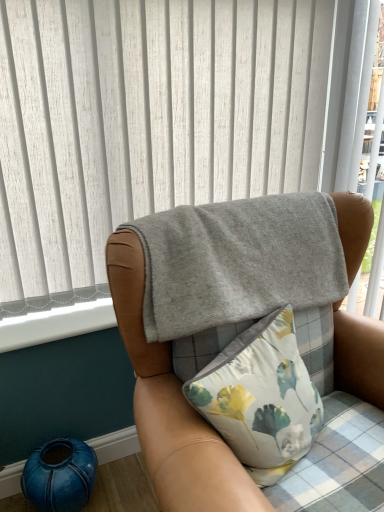
Question: Could you tell me if gray fleece blanket at upper center is facing white smooth window sill at lower left?

Choices:
 (A) yes
 (B) no

Answer: (B)

Question: Is gray fleece blanket at upper center to the right of white smooth window sill at lower left from the viewer's perspective?

Choices:
 (A) no
 (B) yes

Answer: (B)

Question: Does gray fleece blanket at upper center have a larger size compared to white smooth window sill at lower left?

Choices:
 (A) yes
 (B) no

Answer: (A)

Question: Can you confirm if gray fleece blanket at upper center is smaller than white smooth window sill at lower left?

Choices:
 (A) yes
 (B) no

Answer: (B)

Question: From a real-world perspective, is gray fleece blanket at upper center positioned over white smooth window sill at lower left based on gravity?

Choices:
 (A) no
 (B) yes

Answer: (A)

Question: Does gray fleece blanket at upper center have a lesser height compared to white smooth window sill at lower left?

Choices:
 (A) no
 (B) yes

Answer: (A)

Question: From a real-world perspective, does gray fleece blanket at upper center stand above gray felt blanket at upper center?

Choices:
 (A) no
 (B) yes

Answer: (A)

Question: Is gray fleece blanket at upper center not close to gray felt blanket at upper center?

Choices:
 (A) no
 (B) yes

Answer: (A)

Question: Considering the relative sizes of gray fleece blanket at upper center and gray felt blanket at upper center in the image provided, is gray fleece blanket at upper center smaller than gray felt blanket at upper center?

Choices:
 (A) yes
 (B) no

Answer: (B)

Question: Is gray fleece blanket at upper center turned away from gray felt blanket at upper center?

Choices:
 (A) yes
 (B) no

Answer: (A)

Question: Does gray fleece blanket at upper center appear on the right side of gray felt blanket at upper center?

Choices:
 (A) no
 (B) yes

Answer: (B)

Question: Is gray fleece blanket at upper center further to camera compared to gray felt blanket at upper center?

Choices:
 (A) no
 (B) yes

Answer: (A)

Question: Can you confirm if teal ceramic vase at lower left is thinner than white smooth window sill at lower left?

Choices:
 (A) no
 (B) yes

Answer: (A)